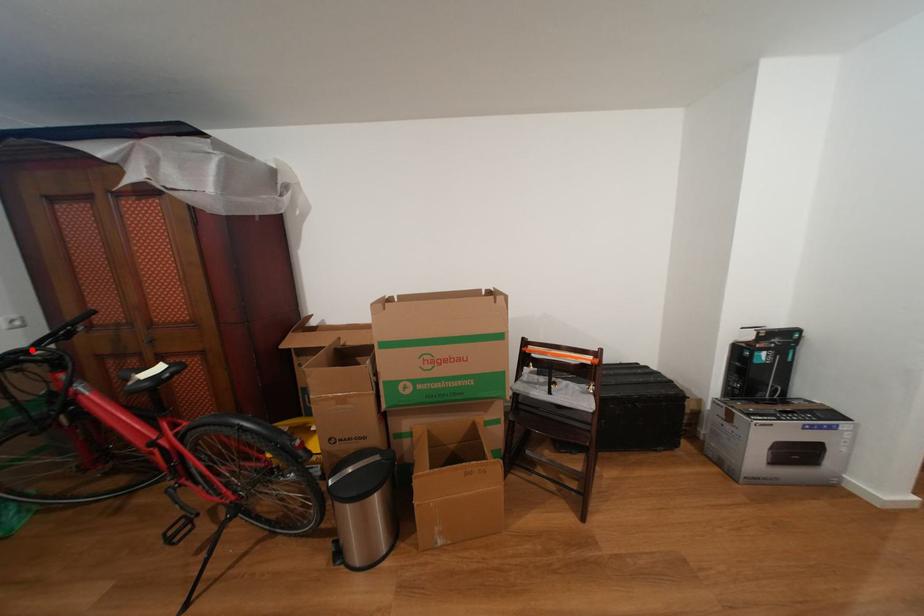
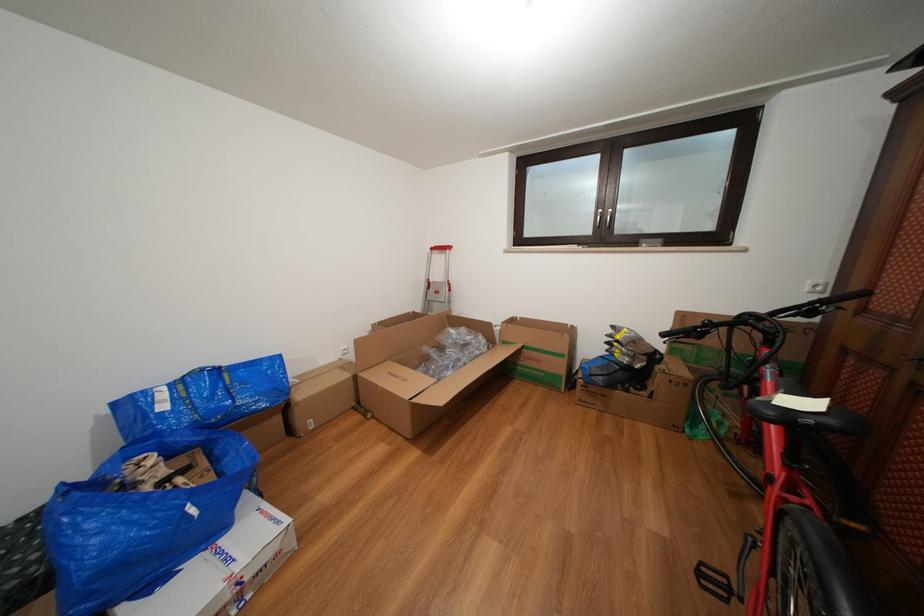
Question: A red point is marked in image1. In image2, is the corresponding 3D point closer to the camera or farther? Reply with the corresponding letter.

Choices:
 (A) The corresponding 3D point is closer.
 (B) The corresponding 3D point is farther.

Answer: (B)